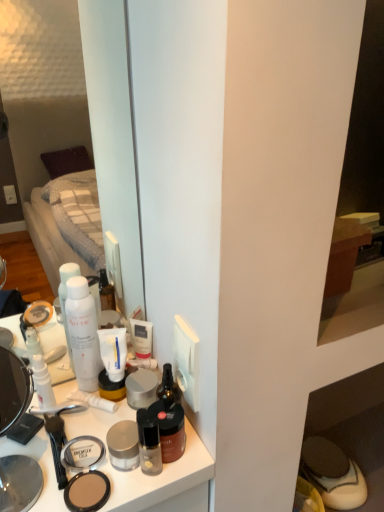
What are the coordinates of `vacant space situated on the left part of brown matte jar at center, which appears as the 1th toiletry when viewed from the right` in the screenshot? It's located at (74, 444).